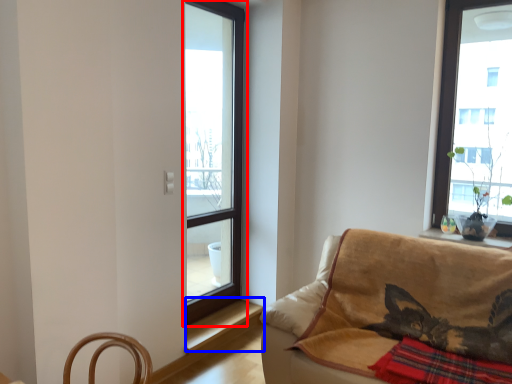
Question: Among these objects, which one is nearest to the camera, window (highlighted by a red box) or window sill (highlighted by a blue box)?

Choices:
 (A) window
 (B) window sill

Answer: (A)